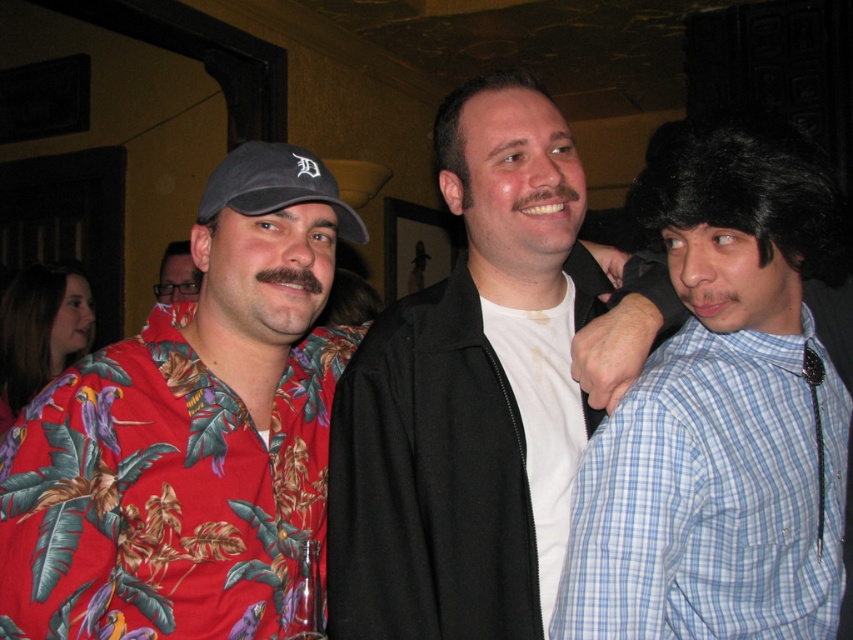
Which is in front, point (126, 396) or point (234, 188)?

Point (126, 396)

Where is `floral shirt at center`? floral shirt at center is located at coordinates (189, 433).

Is blue plaid shirt at right positioned in front of white matte shirt at center?

Yes, blue plaid shirt at right is closer to the viewer.

Between blue plaid shirt at right and white matte shirt at center, which one has less height?

blue plaid shirt at right

Which is in front, point (834, 404) or point (572, 387)?

Point (834, 404) is in front.

Find the location of a particular element. blue plaid shirt at right is located at coordinates point(712,497).

Is floral shirt at center taller than white matte shirt at center?

Yes.

In order to click on floral shirt at center in this screenshot , I will do `click(189, 433)`.

Locate an element on the screen. floral shirt at center is located at coordinates (189, 433).